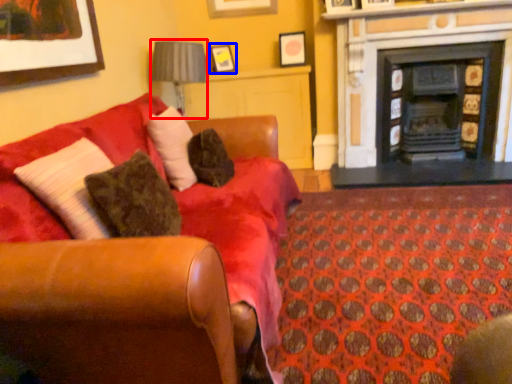
Question: Among these objects, which one is nearest to the camera, lamp (highlighted by a red box) or picture frame (highlighted by a blue box)?

Choices:
 (A) lamp
 (B) picture frame

Answer: (A)